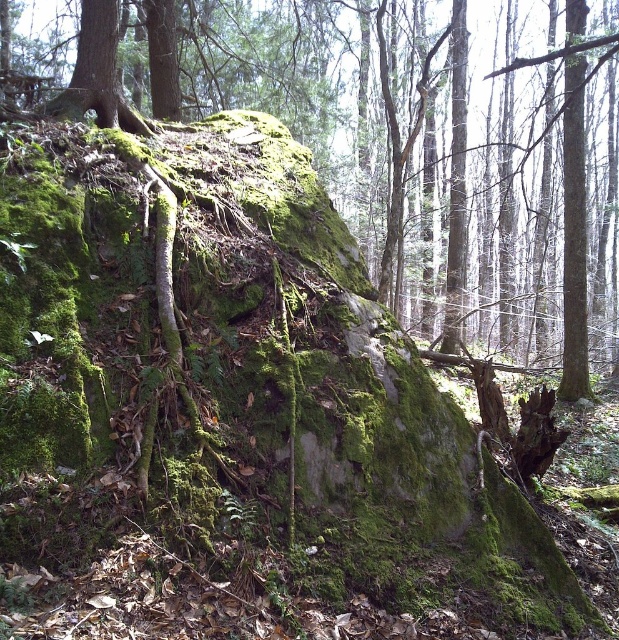
Does point (438, 88) come closer to viewer compared to point (584, 8)?

No, it is not.

Identify the location of green mossy rock at center. (444, 154).

Between point (579, 321) and point (579, 221), which one is positioned behind?

Point (579, 321)

At what (x,y) coordinates should I click in order to perform the action: click on green mossy rock at center. Please return your answer as a coordinate pair (x, y). This screenshot has width=619, height=640. Looking at the image, I should click on (444, 154).